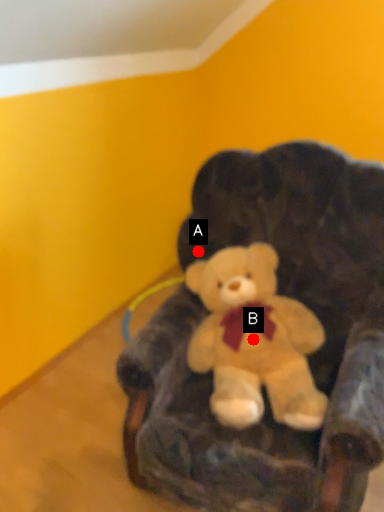
Question: Two points are circled on the image, labeled by A and B beside each circle. Among these points, which one is nearest to the camera?

Choices:
 (A) A is closer
 (B) B is closer

Answer: (B)